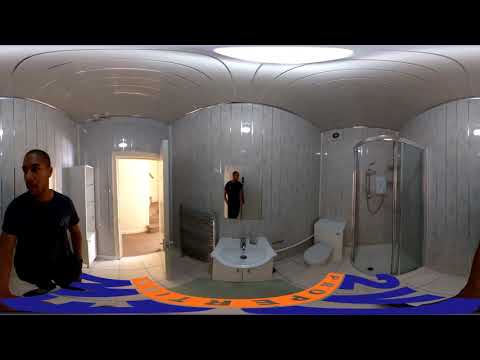
Find the location of a particular element. This screenshot has height=360, width=480. tile wall is located at coordinates (193, 146), (299, 145), (446, 153), (20, 121), (115, 130).